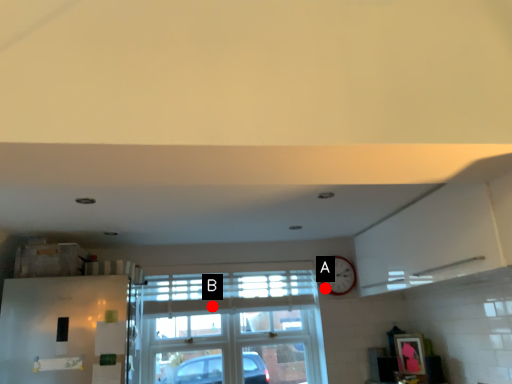
Question: Two points are circled on the image, labeled by A and B beside each circle. Which point is farther to the camera?

Choices:
 (A) A is further
 (B) B is further

Answer: (A)